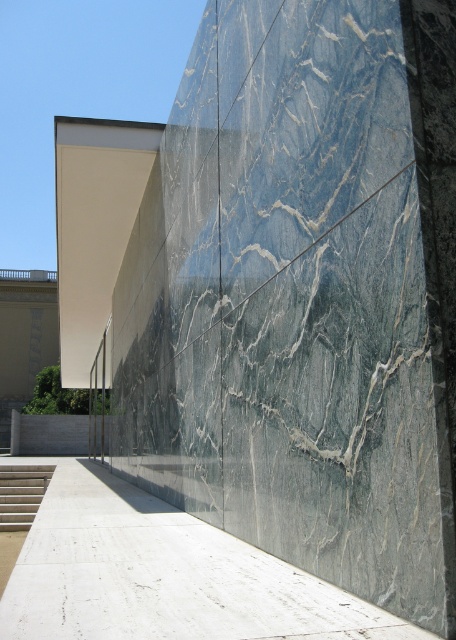
You are standing at the entrance of the building and want to walk towards the white polished concrete at lower center. Which direction should you turn to reach it from the white concrete stairs at lower left?

You should turn to your right to reach the white polished concrete at lower center from the white concrete stairs at lower left because it is located to the right of the stairs.

You are a visitor approaching the modern architectural structure and need to decide whether to walk on the white polished concrete at lower center or the white concrete stairs at lower left. Based on their widths, which path would allow you to walk more comfortably?

The white polished concrete at lower center has a larger width than the white concrete stairs at lower left, so walking on the white polished concrete at lower center would provide more comfortable space.